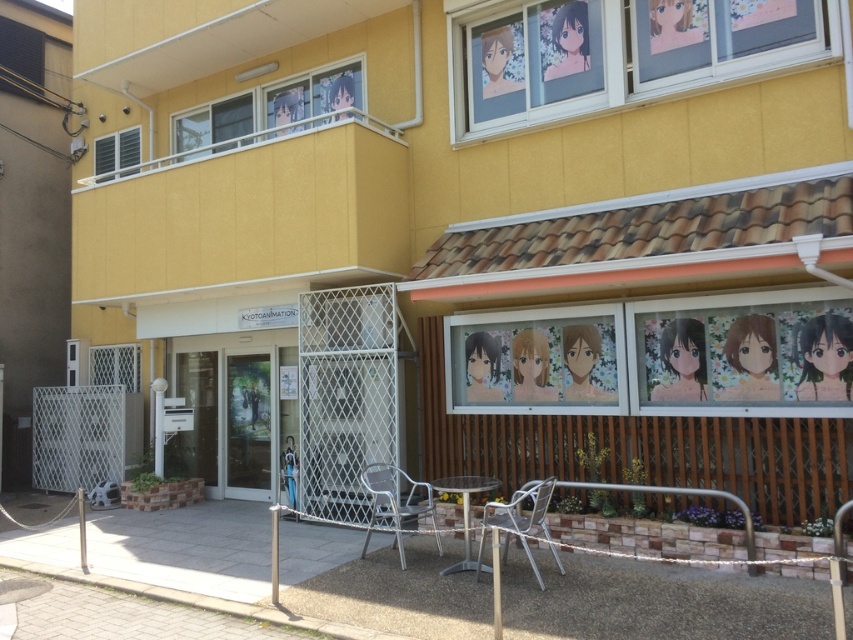
Question: Which object appears farthest from the camera in this image?

Choices:
 (A) silver metallic chair at center
 (B) metallic silver chair at lower center

Answer: (A)

Question: Is silver metallic chair at center wider than metallic silver chair at lower center?

Choices:
 (A) no
 (B) yes

Answer: (B)

Question: Can you confirm if silver metallic chair at center is positioned below metallic silver chair at lower center?

Choices:
 (A) yes
 (B) no

Answer: (A)

Question: Which point is farther to the camera?

Choices:
 (A) (526, 522)
 (B) (419, 484)

Answer: (B)

Question: Is silver metallic chair at center positioned behind metallic silver chair at lower center?

Choices:
 (A) no
 (B) yes

Answer: (B)